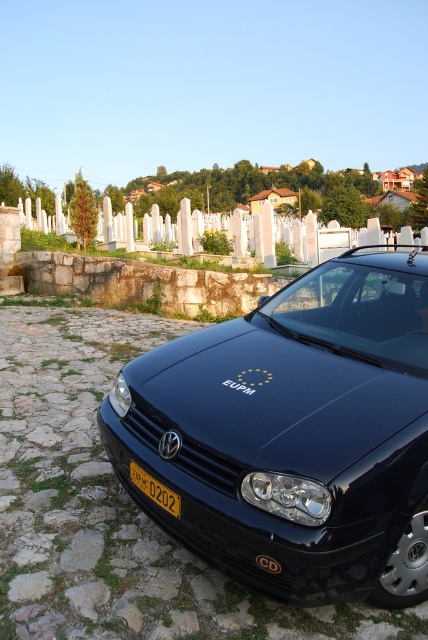
At what (x,y) coordinates should I click in order to perform the action: click on glossy black car at center. Please return your answer as a coordinate pair (x, y). Image resolution: width=428 pixels, height=640 pixels. Looking at the image, I should click on point(294,435).

Who is higher up, glossy black car at center or yellow matte license plate at center?

glossy black car at center

Is point (369, 552) closer to camera compared to point (157, 502)?

Yes.

This screenshot has height=640, width=428. What are the coordinates of `glossy black car at center` in the screenshot? It's located at (294, 435).